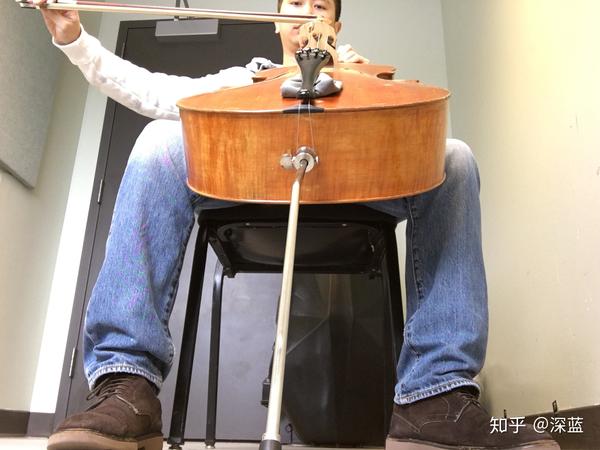
Where is `underside of chair`? The width and height of the screenshot is (600, 450). underside of chair is located at coordinates (319, 240).